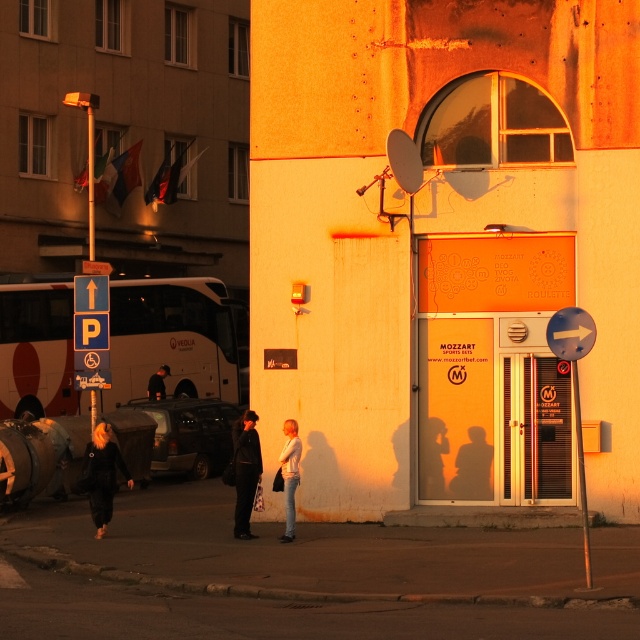
Question: Estimate the real-world distances between objects in this image. Which object is closer to the denim jacket at lower center?

Choices:
 (A) white matte bus at left
 (B) black leather coat at center

Answer: (B)

Question: Which point is closer to the camera?

Choices:
 (A) white matte bus at left
 (B) black leather jacket at lower left
 (C) dark brown leather jacket at center

Answer: (B)

Question: Can you confirm if black leather jacket at lower left is bigger than dark brown leather jacket at center?

Choices:
 (A) yes
 (B) no

Answer: (A)

Question: Can you confirm if black leather coat at center is positioned below denim jacket at lower center?

Choices:
 (A) no
 (B) yes

Answer: (B)

Question: Is white matte bus at left behind black leather coat at center?

Choices:
 (A) yes
 (B) no

Answer: (A)

Question: Which point is farther to the camera?

Choices:
 (A) (243, 516)
 (B) (163, 385)

Answer: (B)